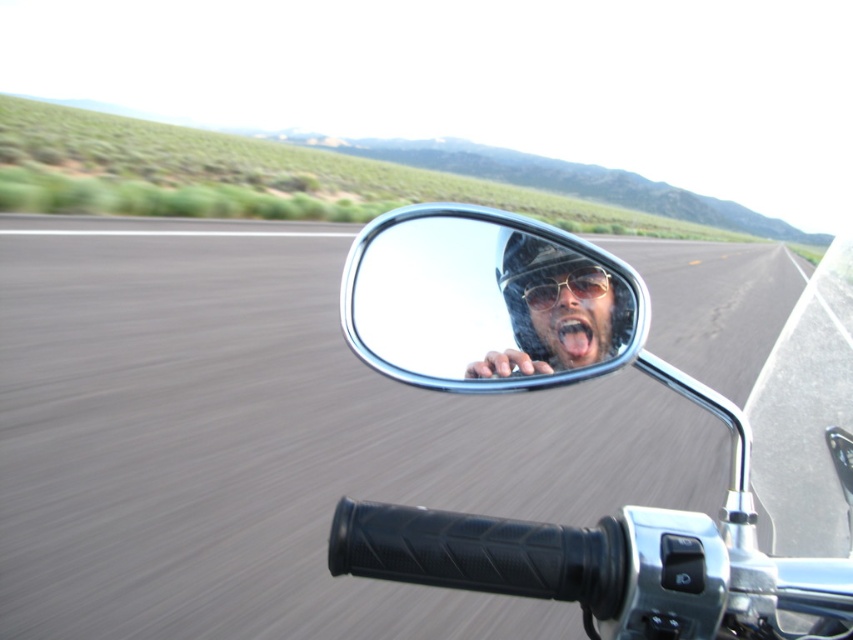
Does silver metallic mirror at center appear over shiny metallic helmet at center?

Yes, silver metallic mirror at center is above shiny metallic helmet at center.

Is point (552, 346) closer to viewer compared to point (566, 291)?

Yes.

I want to click on silver metallic mirror at center, so click(486, 300).

Is shiny metallic helmet at side mirror positioned behind metallic reflective sunglasses at center?

That is False.

How much distance is there between shiny metallic helmet at side mirror and metallic reflective sunglasses at center?

shiny metallic helmet at side mirror and metallic reflective sunglasses at center are 0.87 inches apart.

Does point (584, 296) come in front of point (581, 282)?

Yes, it is in front of point (581, 282).

Where is `shiny metallic helmet at side mirror`? shiny metallic helmet at side mirror is located at coordinates (572, 314).

In the scene shown: Can you confirm if silver metallic mirror at center is positioned to the right of metallic reflective sunglasses at center?

Incorrect, silver metallic mirror at center is not on the right side of metallic reflective sunglasses at center.

Is point (514, 385) farther from camera compared to point (585, 268)?

No.

Find the location of `silver metallic mirror at center`. silver metallic mirror at center is located at coordinates (486, 300).